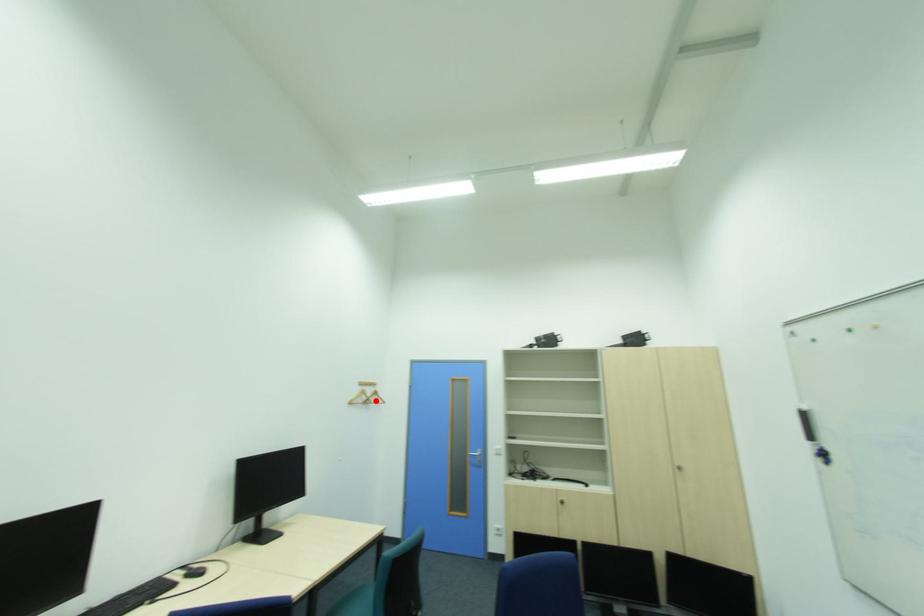
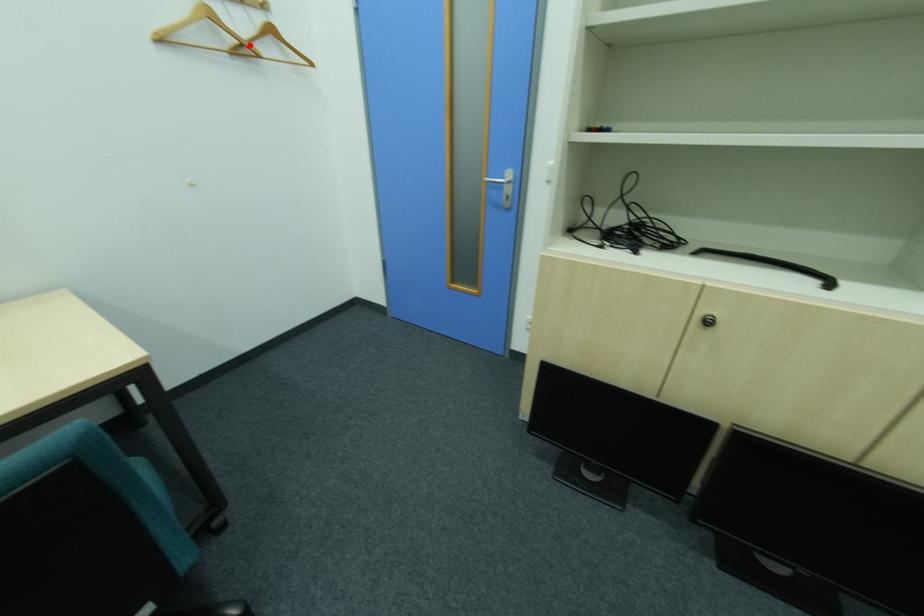
I am providing you with two images of the same scene from different viewpoints. A red point is marked on the first image and another point is marked on the second image. Is the red point in image1 aligned with the point shown in image2?

Yes